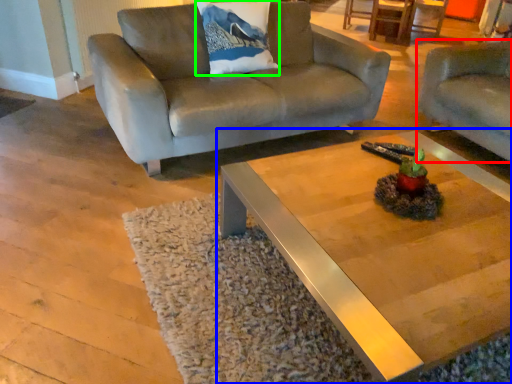
Question: Which object is the farthest from studio couch (highlighted by a red box)? Choose among these: coffee table (highlighted by a blue box) or pillow (highlighted by a green box).

Choices:
 (A) coffee table
 (B) pillow

Answer: (A)